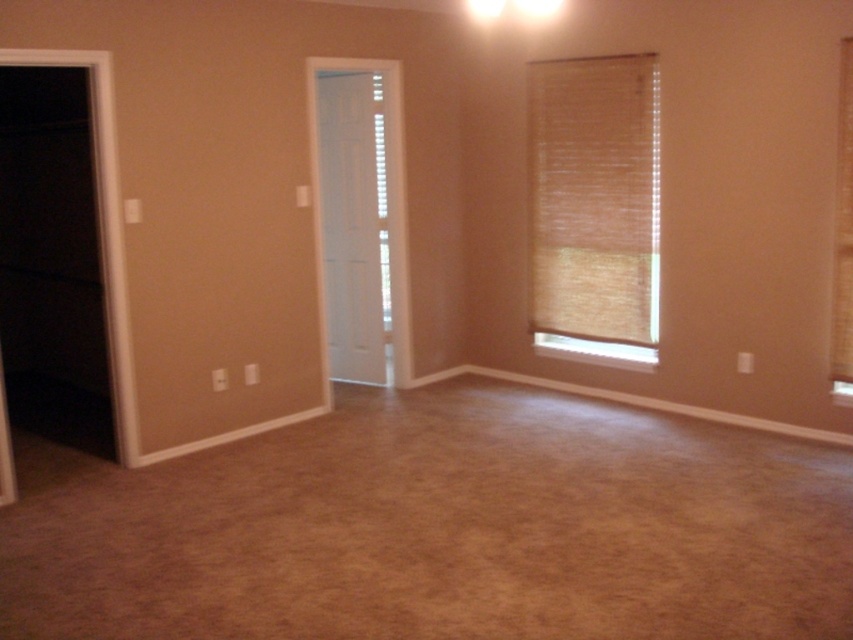
Question: Which object appears closest to the camera in this image?

Choices:
 (A) bamboo blind at right
 (B) brown textured curtain at right

Answer: (B)

Question: Which of the following is the closest to the observer?

Choices:
 (A) brown textured curtain at right
 (B) bamboo blind at right

Answer: (A)

Question: Does bamboo blind at right appear under brown textured curtain at right?

Choices:
 (A) yes
 (B) no

Answer: (B)

Question: Can you confirm if bamboo blind at right is positioned to the left of brown textured curtain at right?

Choices:
 (A) yes
 (B) no

Answer: (A)

Question: Which point appears closest to the camera in this image?

Choices:
 (A) (576, 285)
 (B) (840, 209)

Answer: (B)

Question: Does bamboo blind at right appear over brown textured curtain at right?

Choices:
 (A) no
 (B) yes

Answer: (B)